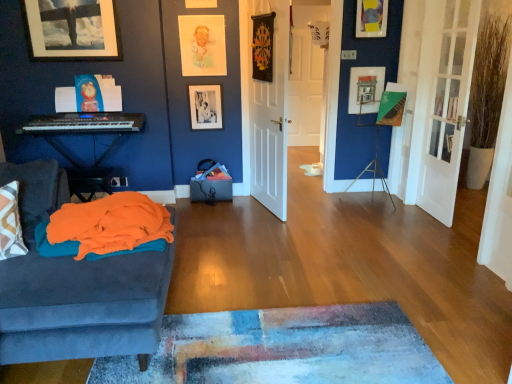
Question: Is matte black keyboard at left wider or thinner than white matte door at center, which ranks as the first door in left-to-right order?

Choices:
 (A) wide
 (B) thin

Answer: (A)

Question: Would you say matte black keyboard at left is to the left or to the right of white matte door at center, which ranks as the first door in left-to-right order, in the picture?

Choices:
 (A) right
 (B) left

Answer: (B)

Question: Considering the real-world distances, which object is closest to the matte black picture frame at upper left, the 1th picture frame from the left?

Choices:
 (A) pastel paper portrait at upper center, which is counted as the third picture frame, starting from the right
 (B) white wooden door at center, the 2th door viewed from the left
 (C) wooden picture frame at upper center, which appears as the 4th picture frame when viewed from the left
 (D) white matte door at center, which ranks as the 2th door in front-to-back order
 (E) white glass door at right, acting as the third door starting from the left

Answer: (A)

Question: Estimate the real-world distances between objects in this image. Which object is closer to the pastel paper portrait at upper center, which is counted as the third picture frame, starting from the right?

Choices:
 (A) matte black picture frame at upper left, which ranks as the fifth picture frame in right-to-left order
 (B) matte wooden picture frame at center, marked as the 5th picture frame in a left-to-right arrangement
 (C) orange soft fabric blanket at left
 (D) white wooden door at center, the 2th door viewed from the left
 (E) white matte door at center, acting as the second door starting from the back

Answer: (E)